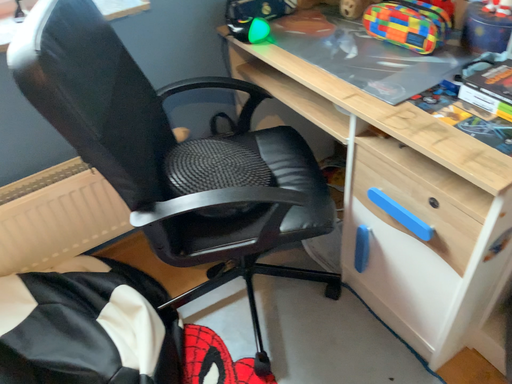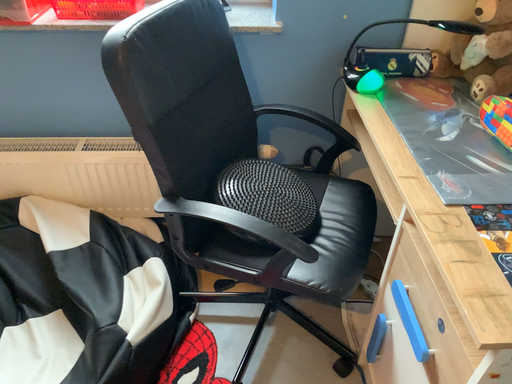
Question: Which way did the camera rotate in the video?

Choices:
 (A) rotated left
 (B) rotated right

Answer: (A)